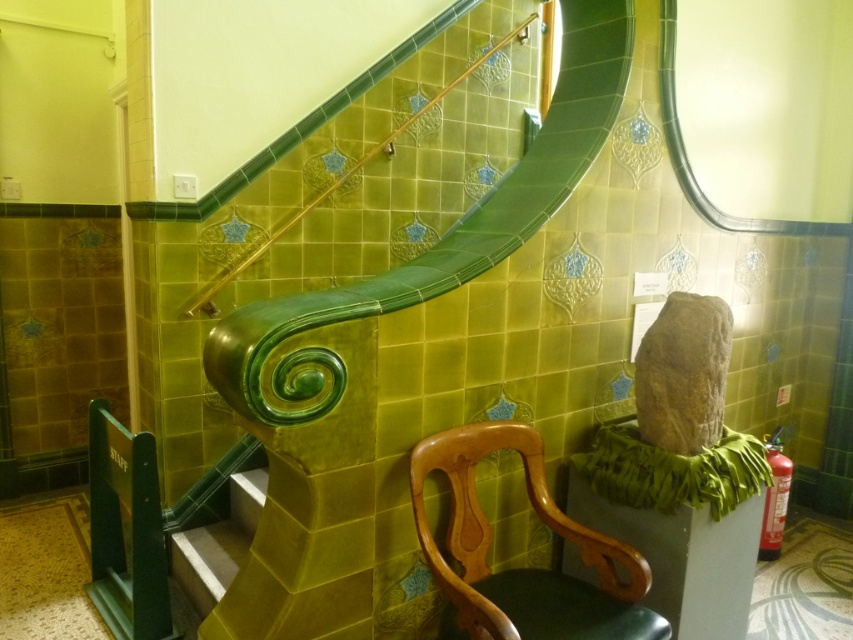
Is wooden chair at center above green glossy stair at lower center?

Correct, wooden chair at center is located above green glossy stair at lower center.

Who is taller, wooden chair at center or green glossy stair at lower center?

With more height is wooden chair at center.

Locate an element on the screen. This screenshot has width=853, height=640. wooden chair at center is located at coordinates (524, 568).

The width and height of the screenshot is (853, 640). Identify the location of wooden chair at center. (524, 568).